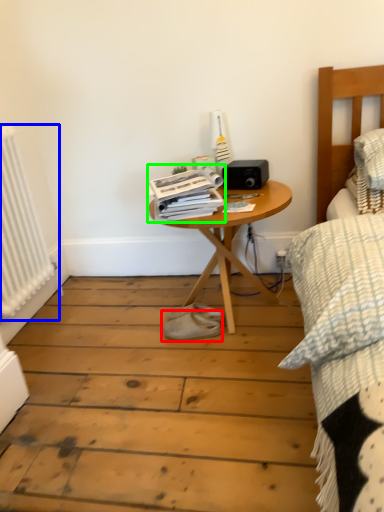
Question: Considering the real-world distances, which object is closest to footwear (highlighted by a red box)? radiator (highlighted by a blue box) or magazine (highlighted by a green box).

Choices:
 (A) radiator
 (B) magazine

Answer: (B)